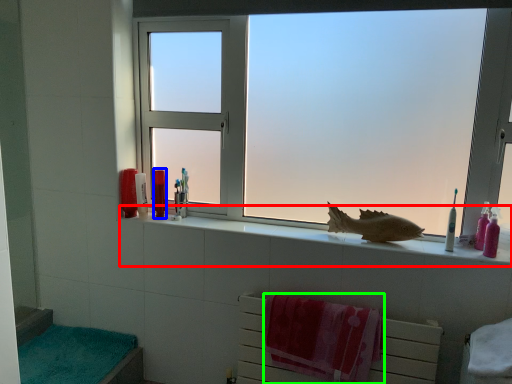
Question: Estimate the real-world distances between objects in this image. Which object is farther from window sill (highlighted by a red box), toiletry (highlighted by a blue box) or beach towel (highlighted by a green box)?

Choices:
 (A) toiletry
 (B) beach towel

Answer: (A)